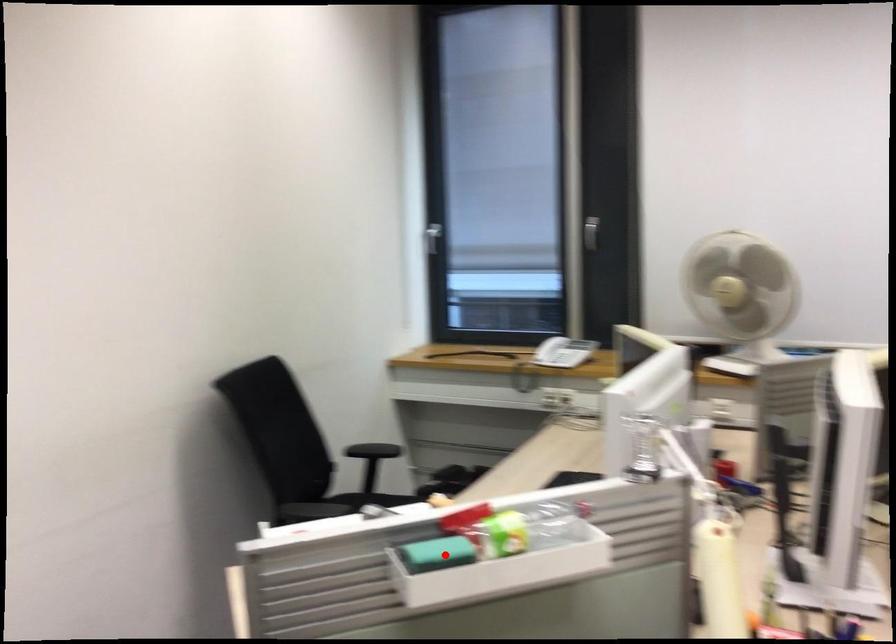
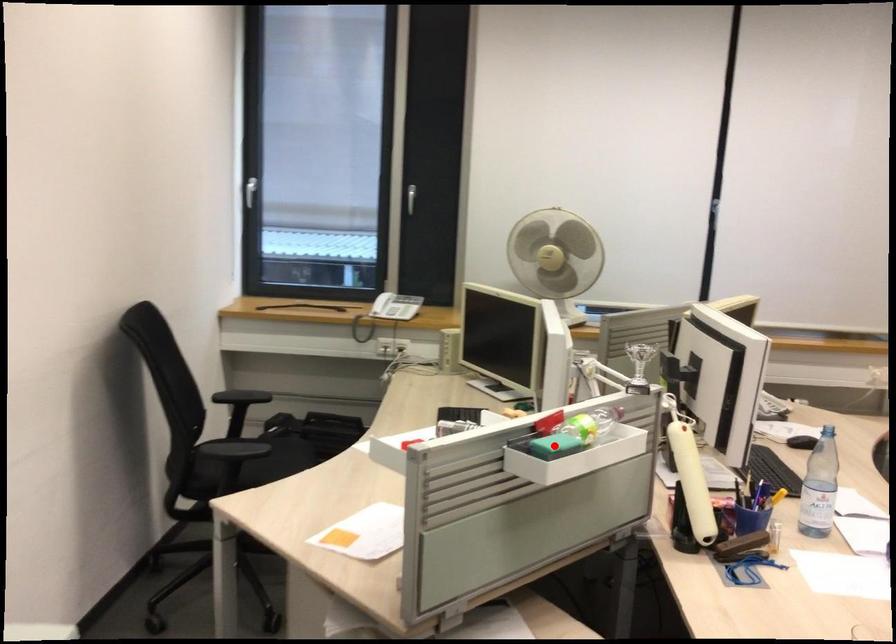
I am providing you with two images of the same scene from different viewpoints. A red point is marked on the first image and another point is marked on the second image. Is the marked point in image1 the same physical position as the marked point in image2?

Yes